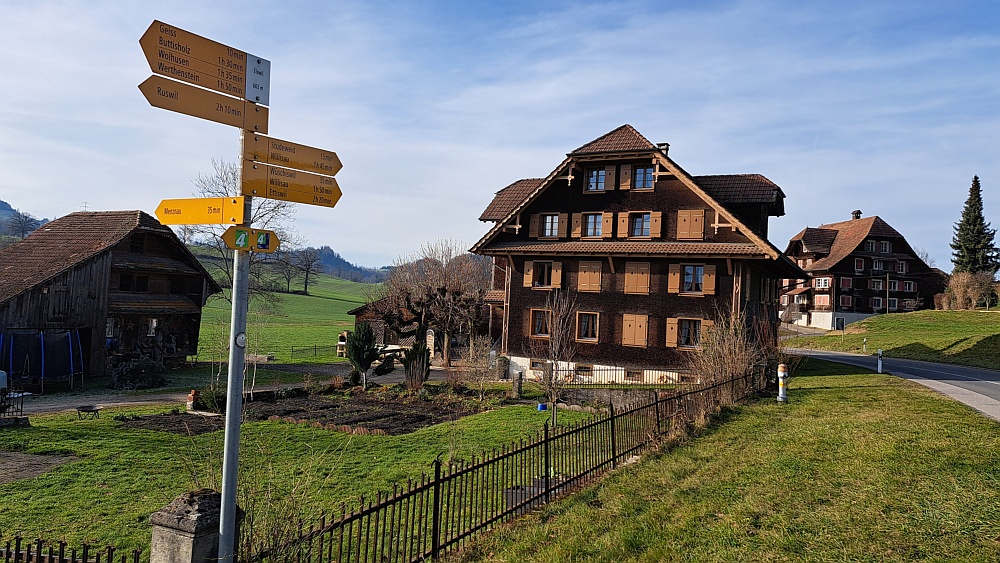
Locate an element on the screen. windows is located at coordinates (600, 182), (638, 181), (640, 217), (595, 225), (688, 274), (546, 274).